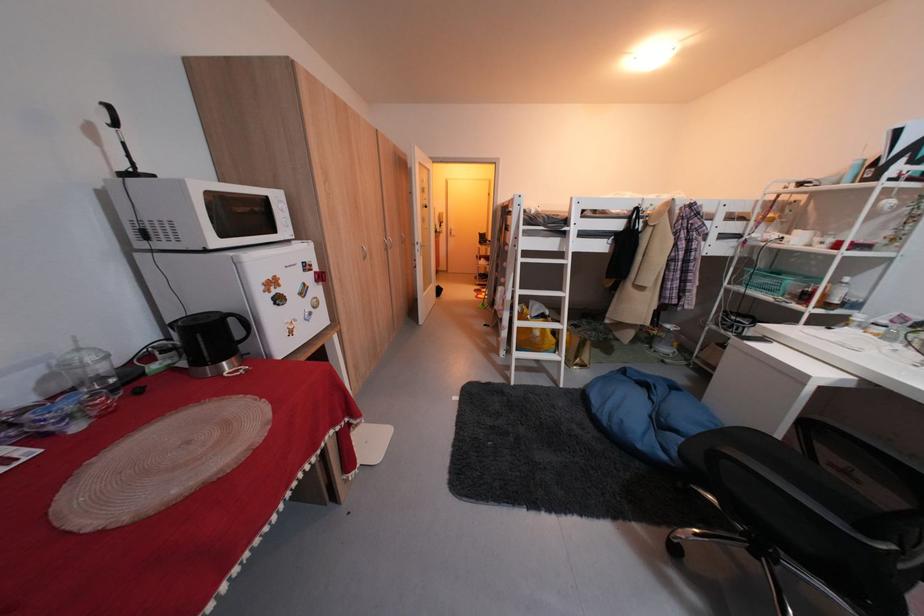
What do you see at coordinates (83, 362) in the screenshot?
I see `a glass jar lid` at bounding box center [83, 362].